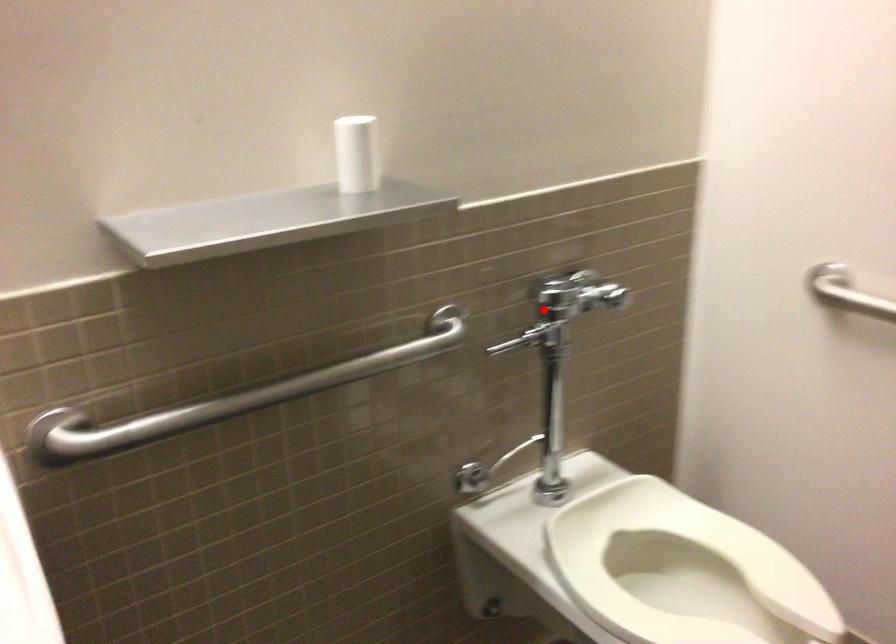
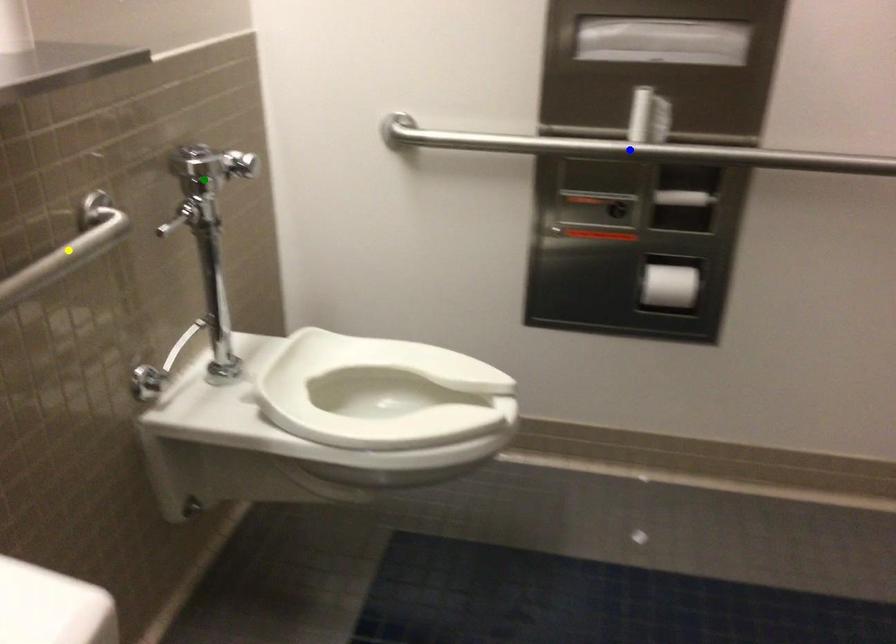
Question: I am providing you with two images of the same scene from different viewpoints. A red point is marked on the first image. You are given multiple points on the second image. Can you choose the point in image 2 that corresponds to the point in image 1?

Choices:
 (A) yellow point
 (B) blue point
 (C) green point

Answer: (C)